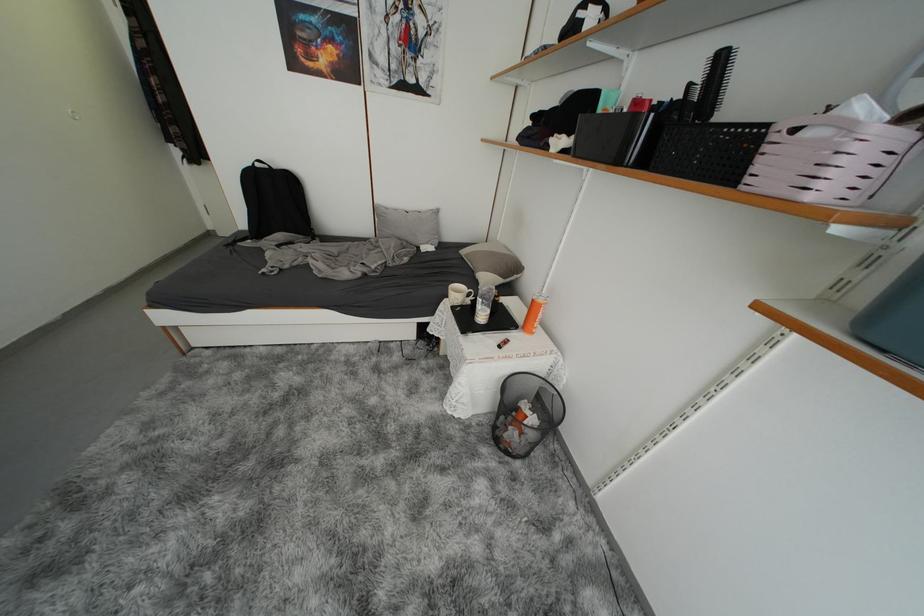
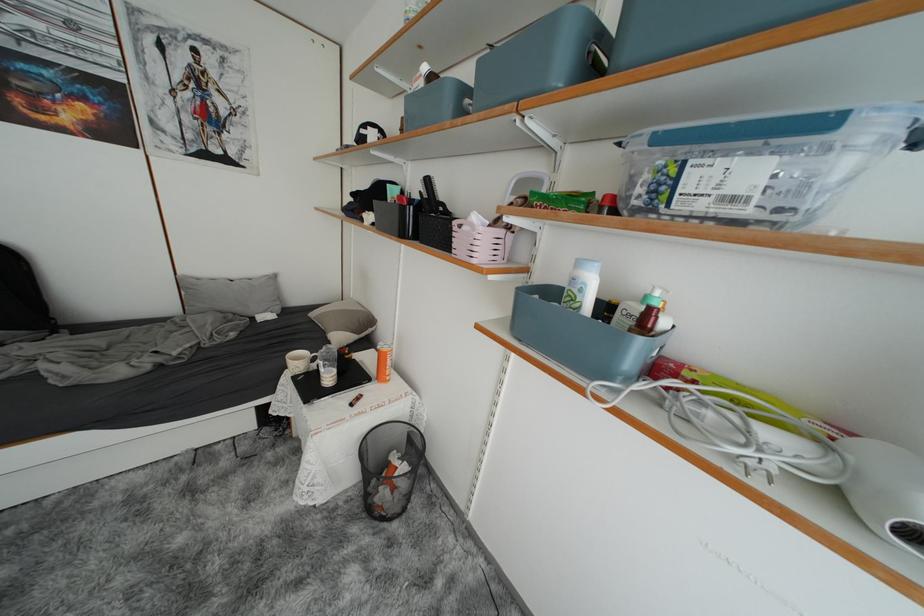
Where in the second image is the point corresponding to pixel 415 213 from the first image?

(238, 281)